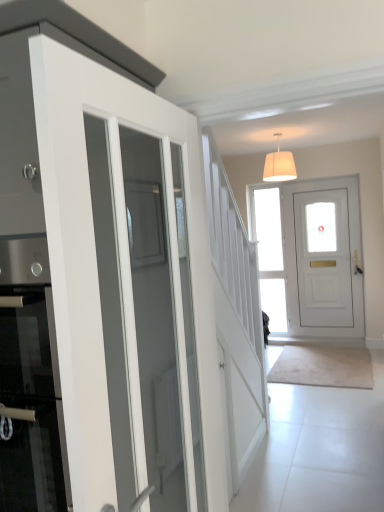
Question: Is clear glass door at center outside of white matte door at center, the second door positioned from the front?

Choices:
 (A) no
 (B) yes

Answer: (B)

Question: Is clear glass door at center oriented towards white matte door at center, the second door positioned from the front?

Choices:
 (A) no
 (B) yes

Answer: (A)

Question: From a real-world perspective, does clear glass door at center stand above white matte door at center, the 1th door from the right?

Choices:
 (A) no
 (B) yes

Answer: (B)

Question: Does clear glass door at center have a greater width compared to white matte door at center, the second door from the left?

Choices:
 (A) no
 (B) yes

Answer: (A)

Question: Does clear glass door at center have a lesser width compared to white matte door at center, the second door positioned from the front?

Choices:
 (A) yes
 (B) no

Answer: (A)

Question: Does clear glass door at center have a larger size compared to white matte door at center, the second door from the left?

Choices:
 (A) no
 (B) yes

Answer: (A)

Question: From the image's perspective, is white fabric lampshade at upper center over clear glass door at center?

Choices:
 (A) no
 (B) yes

Answer: (B)

Question: Would you say clear glass door at center is part of white fabric lampshade at upper center's contents?

Choices:
 (A) yes
 (B) no

Answer: (B)

Question: Could you tell me if white fabric lampshade at upper center is facing clear glass door at center?

Choices:
 (A) yes
 (B) no

Answer: (B)

Question: Considering the relative sizes of white fabric lampshade at upper center and clear glass door at center in the image provided, is white fabric lampshade at upper center thinner than clear glass door at center?

Choices:
 (A) no
 (B) yes

Answer: (A)

Question: Can you confirm if white fabric lampshade at upper center is positioned to the left of clear glass door at center?

Choices:
 (A) no
 (B) yes

Answer: (B)

Question: From a real-world perspective, is white fabric lampshade at upper center physically below clear glass door at center?

Choices:
 (A) yes
 (B) no

Answer: (B)

Question: Is white matte door at center, the second door from the left, at the back of white glossy door at left, which is the 1th door from left to right?

Choices:
 (A) yes
 (B) no

Answer: (B)